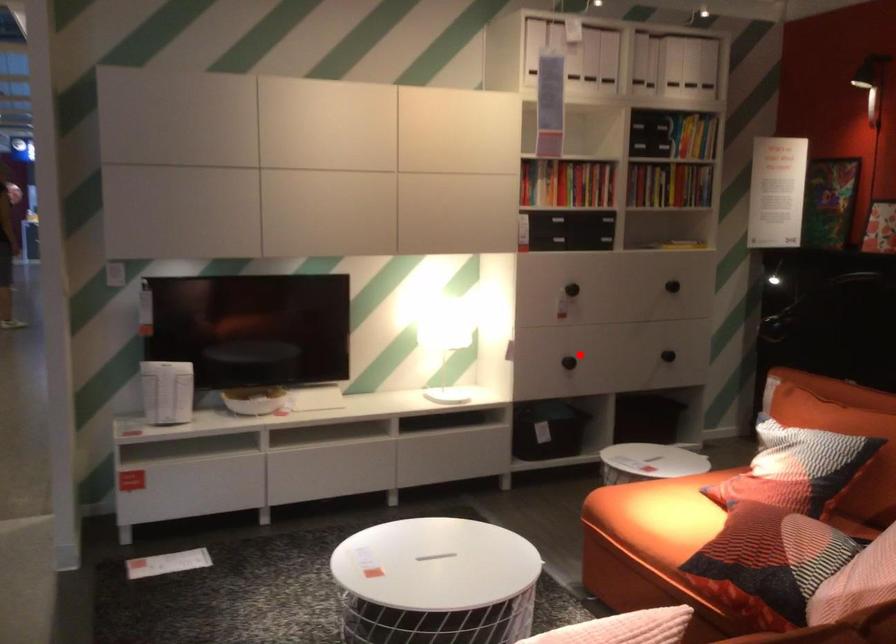
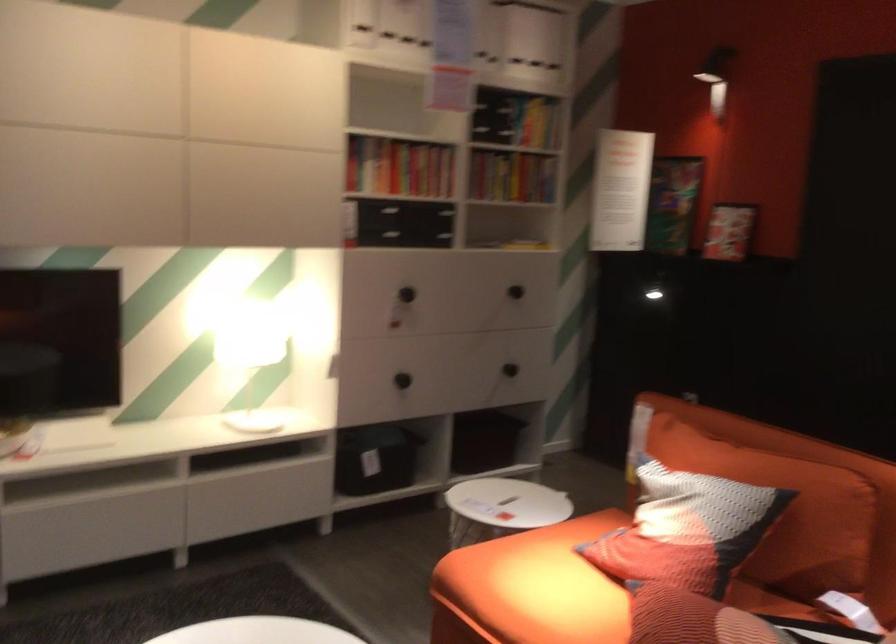
Question: A red point is marked in image1. In image2, is the corresponding 3D point closer to the camera or farther? Reply with the corresponding letter.

Choices:
 (A) The corresponding 3D point is closer.
 (B) The corresponding 3D point is farther.

Answer: (A)